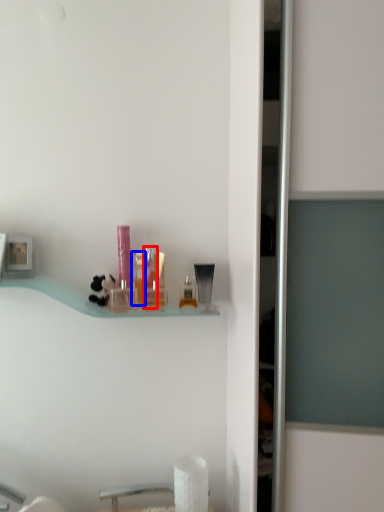
Question: Which of the following is the farthest to the observer, toiletry (highlighted by a red box) or toiletry (highlighted by a blue box)?

Choices:
 (A) toiletry
 (B) toiletry

Answer: (A)